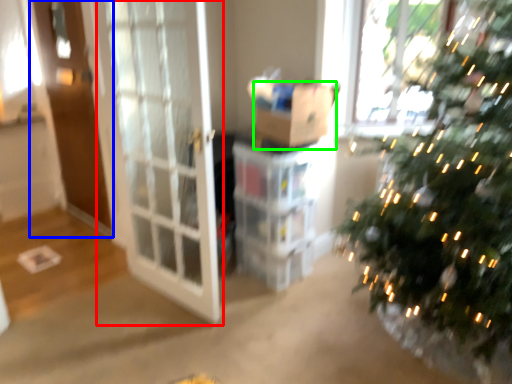
Question: Estimate the real-world distances between objects in this image. Which object is closer to screen door (highlighted by a red box), screen door (highlighted by a blue box) or cardboard box (highlighted by a green box)?

Choices:
 (A) screen door
 (B) cardboard box

Answer: (B)